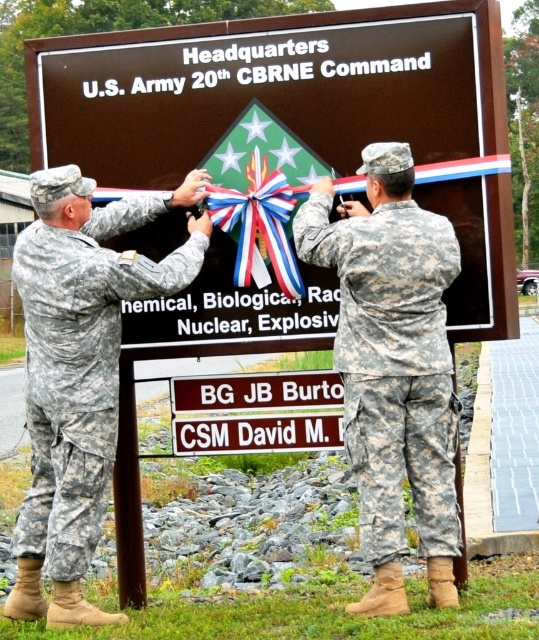
Locate an element on the screen. camouflage fabric uniform at center is located at coordinates (392, 364).

Between camouflage fabric uniform at center and shiny metallic ribbon at center, which one appears on the left side from the viewer's perspective?

Positioned to the left is shiny metallic ribbon at center.

Is point (369, 250) positioned in front of point (210, 218)?

Yes, it is.

Locate an element on the screen. Image resolution: width=539 pixels, height=640 pixels. camouflage fabric uniform at center is located at coordinates (392, 364).

Is point (268, 166) positioned before point (374, 220)?

No, it is not.

Who is more forward, [474,268] or [453,432]?

Point [453,432] is in front.

Where is `brown matte sign at center`? The height and width of the screenshot is (640, 539). brown matte sign at center is located at coordinates (300, 115).

What are the coordinates of `brown matte sign at center` in the screenshot? It's located at (300, 115).

Is brown matte sign at center above camouflage uniform at left?

Yes.

Between point (153, 49) and point (64, 406), which one is positioned behind?

The point (153, 49) is behind.

Which is in front, point (153, 54) or point (176, 198)?

Positioned in front is point (176, 198).

Identify the location of brown matte sign at center. (300, 115).